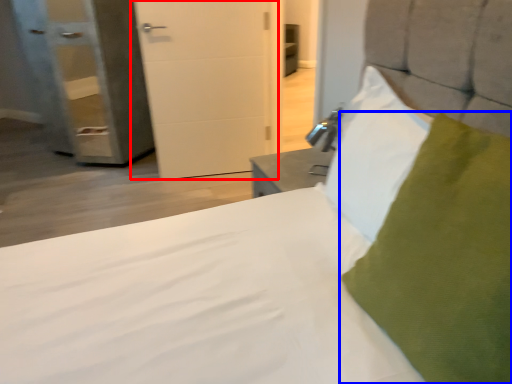
Question: Which object appears closest to the camera in this image, door (highlighted by a red box) or pillow (highlighted by a blue box)?

Choices:
 (A) door
 (B) pillow

Answer: (B)